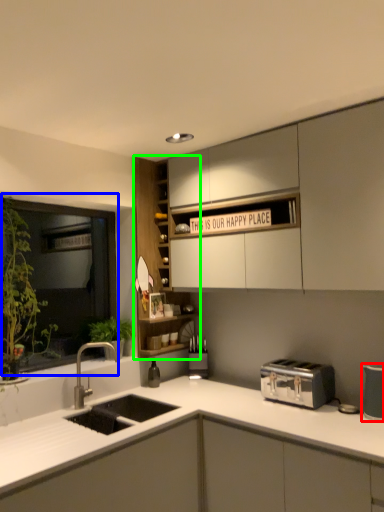
Question: Which object is the closest to the appliance (highlighted by a red box)? Choose among these: window (highlighted by a blue box) or cabinetry (highlighted by a green box).

Choices:
 (A) window
 (B) cabinetry

Answer: (B)